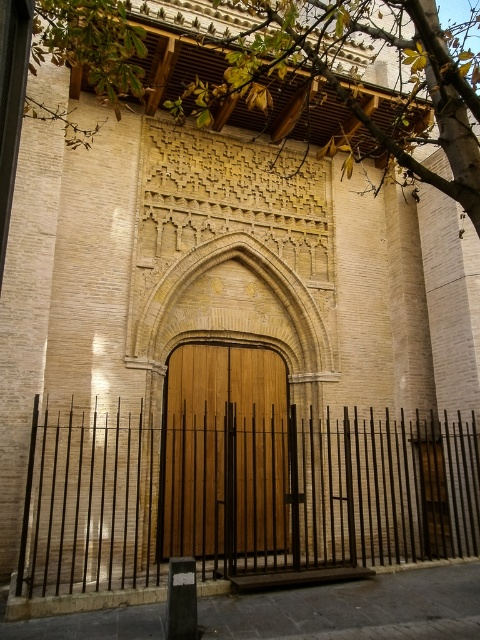
Which is above, black metal fence at center or wooden door at center?

wooden door at center is higher up.

Consider the image. Between black metal fence at center and wooden door at center, which one appears on the right side from the viewer's perspective?

black metal fence at center

Between point (164, 525) and point (259, 550), which one is positioned behind?

Point (259, 550)

Locate an element on the screen. This screenshot has width=480, height=640. black metal fence at center is located at coordinates (240, 496).

Is point (460, 484) farther from viewer compared to point (334, 36)?

Yes, point (460, 484) is farther from viewer.

Is black metal fence at center positioned behind green leafy tree at upper center?

Yes, black metal fence at center is further from the viewer.

Is point (73, 445) closer to camera compared to point (212, 4)?

Yes.

Where is `black metal fence at center`? This screenshot has height=640, width=480. black metal fence at center is located at coordinates (240, 496).

Which is more to the right, green leafy tree at upper center or wooden door at center?

green leafy tree at upper center is more to the right.

Between point (317, 35) and point (189, 442), which one is positioned in front?

Point (317, 35)

What are the coordinates of `green leafy tree at upper center` in the screenshot? It's located at (356, 80).